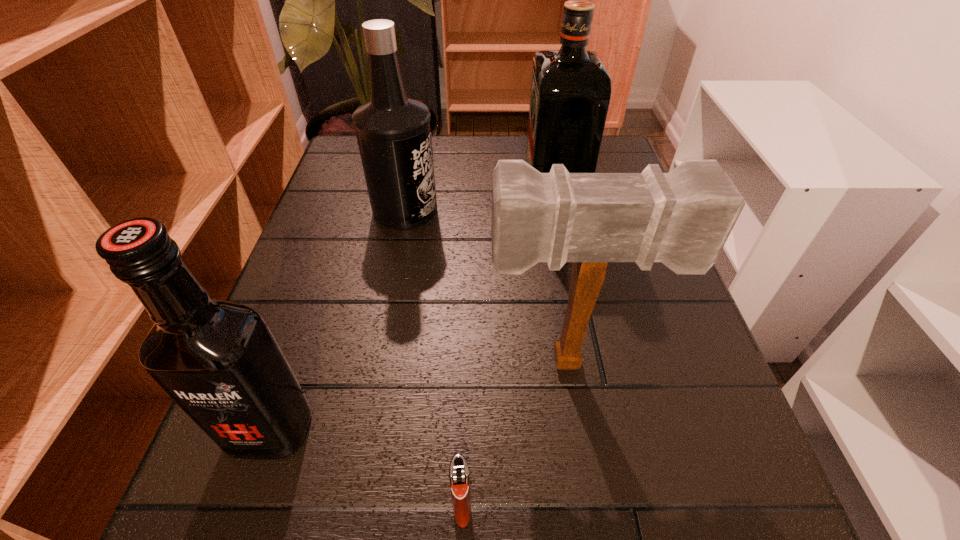
Locate an element on the screen. The width and height of the screenshot is (960, 540). the rightmost liquor is located at coordinates (570, 93).

The height and width of the screenshot is (540, 960). What are the coordinates of `the second liquor from right to left` in the screenshot? It's located at (393, 131).

Locate an element on the screen. the second nearest object is located at coordinates (220, 363).

At what (x,y) coordinates should I click in order to perform the action: click on the nearest liquor. Please return your answer as a coordinate pair (x, y). Looking at the image, I should click on 220,363.

Locate an element on the screen. Image resolution: width=960 pixels, height=540 pixels. the third farthest object is located at coordinates (683, 218).

Image resolution: width=960 pixels, height=540 pixels. I want to click on the nearest object, so click(459, 478).

This screenshot has height=540, width=960. What are the coordinates of `the third object from right to left` in the screenshot? It's located at (459, 478).

Find the location of a particular element. This screenshot has height=540, width=960. vacant space situated 0.200m on the front label of the rightmost liquor is located at coordinates (436, 204).

Where is `free space located 0.050m on the front label of the rightmost liquor`? free space located 0.050m on the front label of the rightmost liquor is located at coordinates (503, 204).

Find the location of a particular element. This screenshot has width=960, height=540. vacant space positioned on the front label of the rightmost liquor is located at coordinates (372, 204).